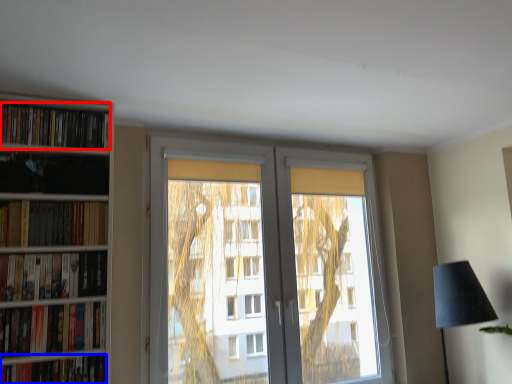
Question: Among these objects, which one is nearest to the camera, book (highlighted by a red box) or book (highlighted by a blue box)?

Choices:
 (A) book
 (B) book

Answer: (B)